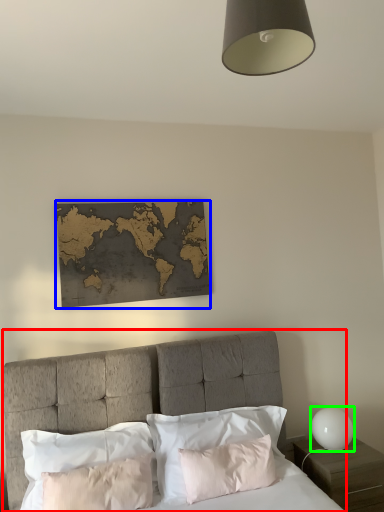
Question: Which object is the closest to the bed (highlighted by a red box)? Choose among these: picture frame (highlighted by a blue box) or table lamp (highlighted by a green box).

Choices:
 (A) picture frame
 (B) table lamp

Answer: (A)